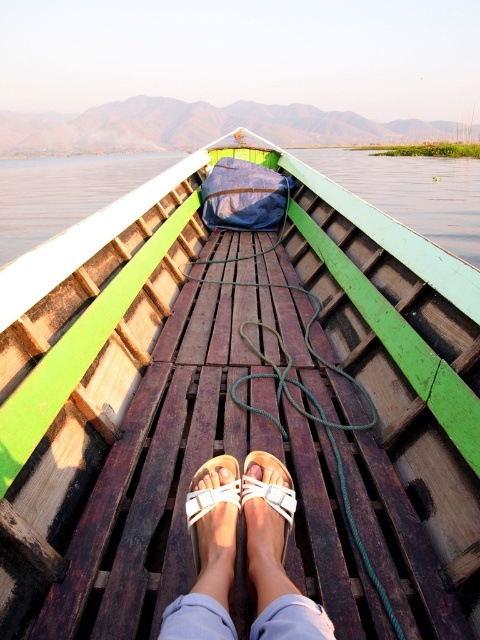
You are sitting in a traditional wooden boat and want to know if you can place a small rectangular box between the transparent water at center and the white leather sandals at center. The box is 1 meter wide. Can it fit?

The transparent water at center is wider than the white leather sandals at center. However, the description does not provide specific measurements of their widths, so it is impossible to determine if the 1 meter box will fit between them.

You are sitting in the boat and want to step onto the deck area behind the transparent water at center. Can you move your white leather sandals at center to that location without touching the water?

The white leather sandals at center is behind the transparent water at center, so you can move them to the deck area behind the transparent water at center without touching the water.

You are sitting in the boat and want to see your reflection in the water. Can you see your feet reflected in the transparent water at center from your white leather sandals at center?

The transparent water at center is above the white leather sandals at center, so your feet would be above the water and not reflected in it.